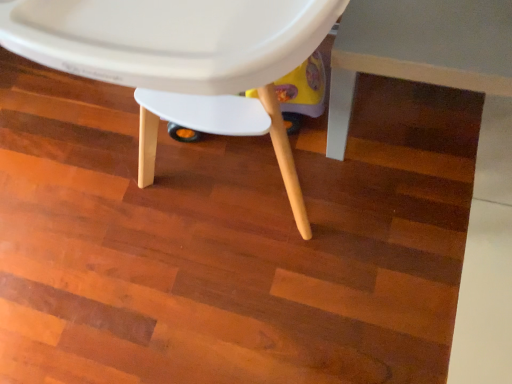
Where is `free space in front of white matte table at lower right`? free space in front of white matte table at lower right is located at coordinates (413, 259).